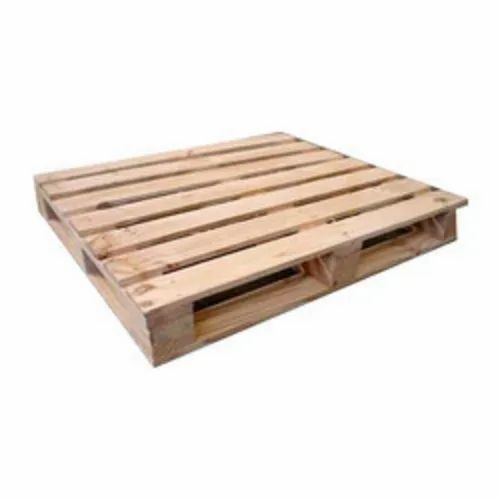
This screenshot has width=500, height=500. Identify the location of corners. (33, 178), (285, 128), (148, 312), (457, 205).